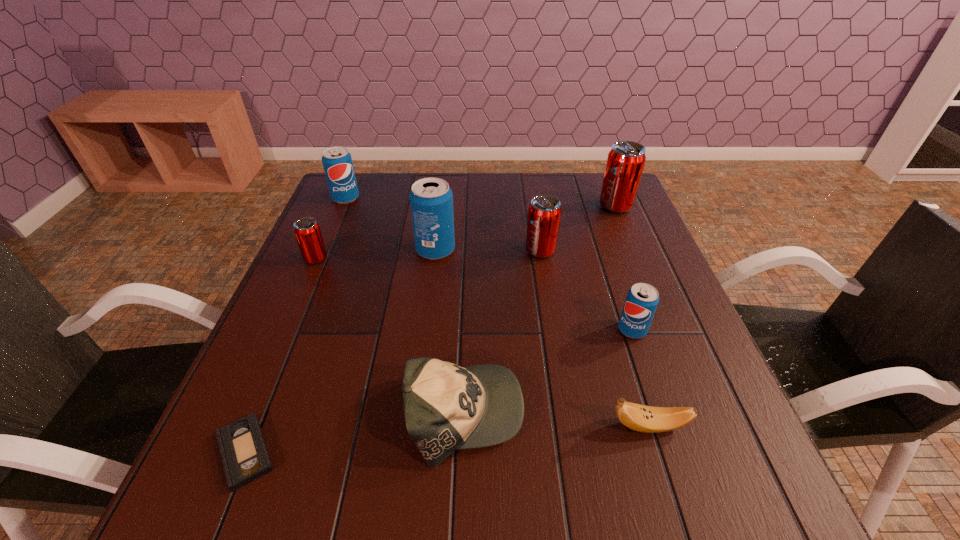
Where is `free point between the smallest blue soda can and the rightmost red soda can`? free point between the smallest blue soda can and the rightmost red soda can is located at coordinates (624, 268).

Identify the location of free space between the second red soda can from right to left and the fourth soda can from right to left. The width and height of the screenshot is (960, 540). (488, 251).

You are a GUI agent. You are given a task and a screenshot of the screen. Output one action in this format:
    pyautogui.click(x=<x>, y=<y>)
    Task: Click on the vacant space that's between the second smallest blue soda can and the third soda can from left to right
    
    Given the screenshot: What is the action you would take?
    pyautogui.click(x=391, y=224)

You are a GUI agent. You are given a task and a screenshot of the screen. Output one action in this format:
    pyautogui.click(x=<x>, y=<y>)
    Task: Click on the empty space between the second smallest red soda can and the yellow banana
    Image resolution: width=960 pixels, height=540 pixels.
    Given the screenshot: What is the action you would take?
    pyautogui.click(x=594, y=339)

The width and height of the screenshot is (960, 540). In order to click on free point between the second blue soda can from left to right and the yellow banana in this screenshot , I will do `click(542, 339)`.

This screenshot has height=540, width=960. I want to click on object that ranks as the seventh closest to the shortest object, so click(x=337, y=162).

Select which object appears as the third closest to the green baseball cap. Please provide its 2D coordinates. Your answer should be formatted as a tuple, i.e. [(x, y)], where the tuple contains the x and y coordinates of a point satisfying the conditions above.

[(642, 299)]

The image size is (960, 540). I want to click on soda can that is the third closest to the smallest red soda can, so click(x=544, y=213).

Where is `the second closest soda can to the smallest blue soda can`? This screenshot has width=960, height=540. the second closest soda can to the smallest blue soda can is located at coordinates (625, 163).

This screenshot has width=960, height=540. In order to click on blue soda can that is the third closest to the shortest object in this screenshot , I will do `click(337, 162)`.